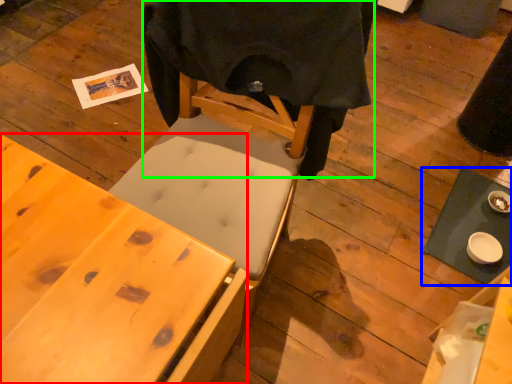
Question: Which object is positioned farthest from desk (highlighted by a red box)? Select from table (highlighted by a blue box) and cloth (highlighted by a green box).

Choices:
 (A) table
 (B) cloth

Answer: (A)